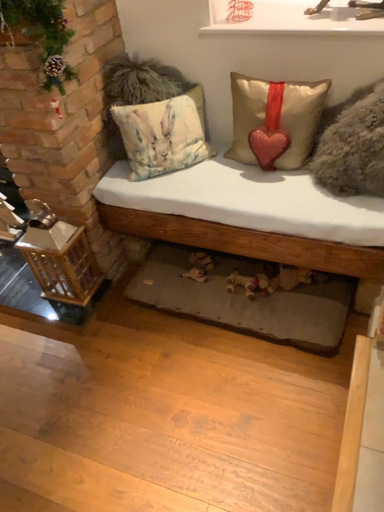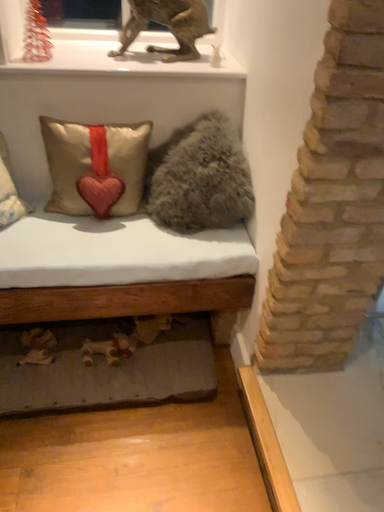
Question: How did the camera likely rotate when shooting the video?

Choices:
 (A) rotated upward
 (B) rotated downward

Answer: (A)